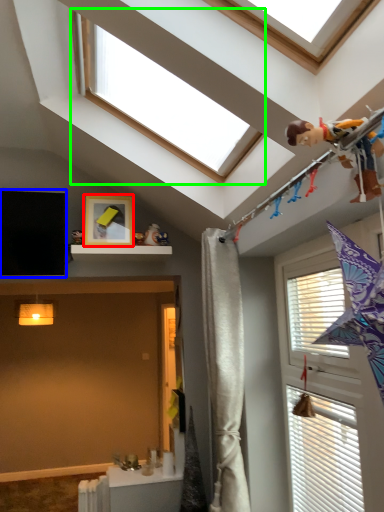
Question: Which object is positioned closest to picture frame (highlighted by a red box)? Select from window screen (highlighted by a blue box) and window (highlighted by a green box).

Choices:
 (A) window screen
 (B) window

Answer: (A)